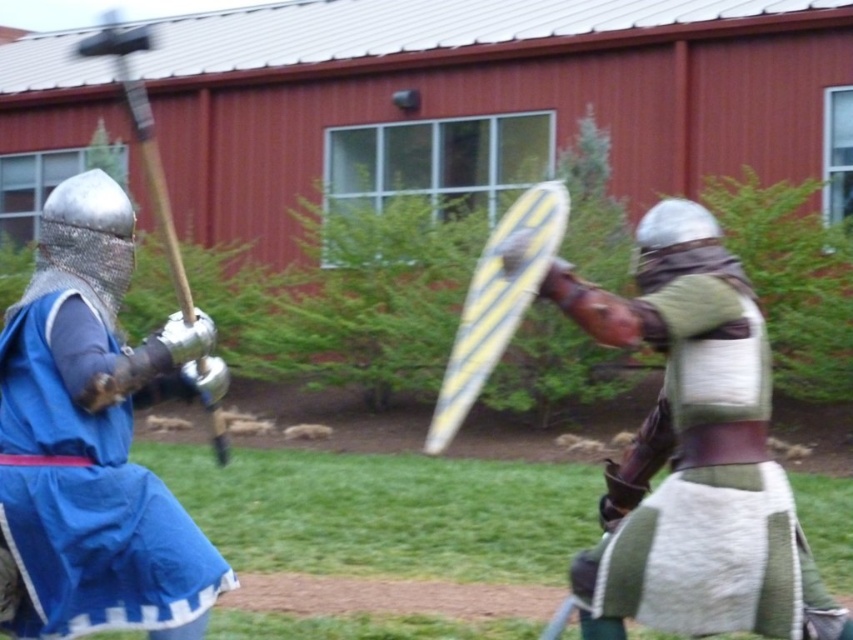
You are a medieval knight observing the scene. There is a green woolen tunic at center and a wooden polished mace at left. Which object is positioned to the right of the other?

The green woolen tunic at center is to the right of wooden polished mace at left.

You are a medieval knight preparing to enter a tournament. You see the shiny blue tunic at left and the wooden polished mace at left in the scene. Which one is closer to you as you face the scene?

The shiny blue tunic at left is closer to you because it is in front of the wooden polished mace at left.

You are a medieval knight preparing to cross a narrow bridge that is only 1.2 meters wide. You see the green woolen tunic at center and the shiny blue tunic at left standing on the bridge. Can you safely pass between them?

The distance between the green woolen tunic at center and the shiny blue tunic at left is 1.33 meters, which is wider than the bridge. Since the bridge is only 1.2 meters wide, you cannot safely pass between them as the gap is insufficient.